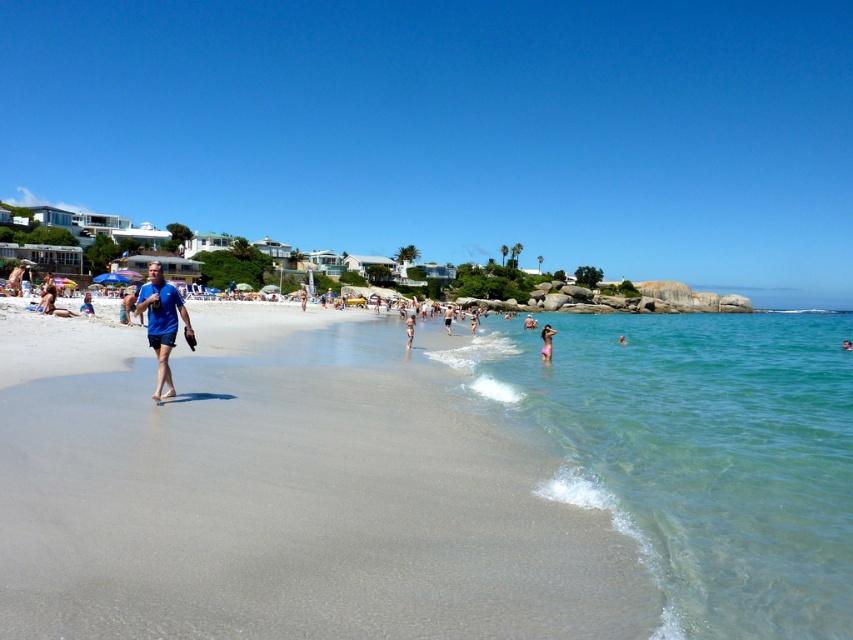
How distant is clear water at beach right from pink fabric at center?

The distance of clear water at beach right from pink fabric at center is 30.04 meters.

Image resolution: width=853 pixels, height=640 pixels. I want to click on clear water at beach right, so click(699, 452).

Is point (561, 316) more distant than point (405, 348)?

That is True.

Where is `clear water at beach right`? The width and height of the screenshot is (853, 640). clear water at beach right is located at coordinates (699, 452).

The height and width of the screenshot is (640, 853). I want to click on blue fabric shirt at left, so click(x=126, y=305).

How much distance is there between blue fabric shirt at left and pink fabric at center?

blue fabric shirt at left is 18.72 meters from pink fabric at center.

Describe the element at coordinates (126, 305) in the screenshot. I see `blue fabric shirt at left` at that location.

Image resolution: width=853 pixels, height=640 pixels. Find the location of `blue fabric shirt at left`. blue fabric shirt at left is located at coordinates (126, 305).

Which of these two, blue matte shorts at left or pink fabric at center, stands taller?

Standing taller between the two is blue matte shorts at left.

Is blue matte shorts at left positioned behind pink fabric at center?

No.

Who is more forward, (152, 298) or (408, 332)?

Positioned in front is point (152, 298).

Identify the location of blue matte shorts at left. (161, 323).